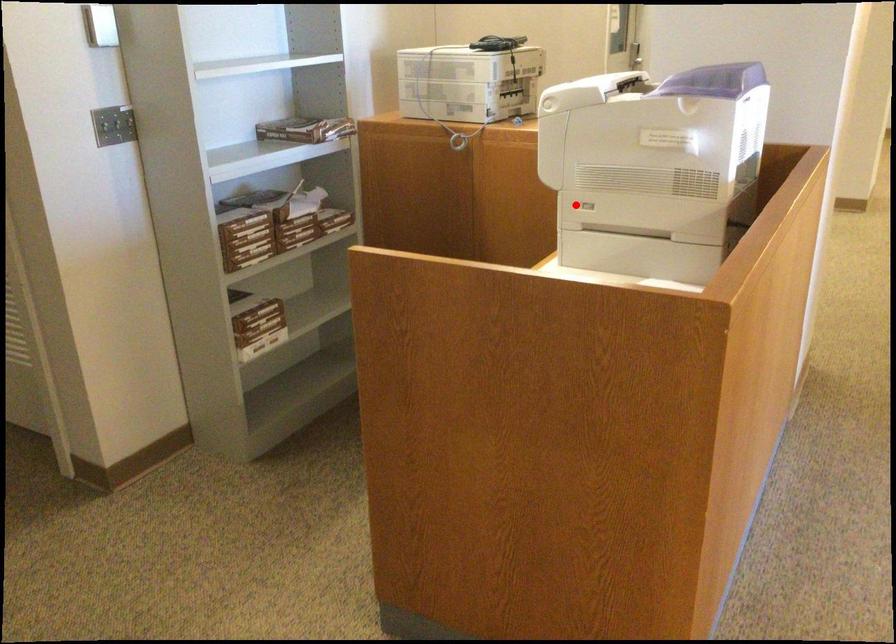
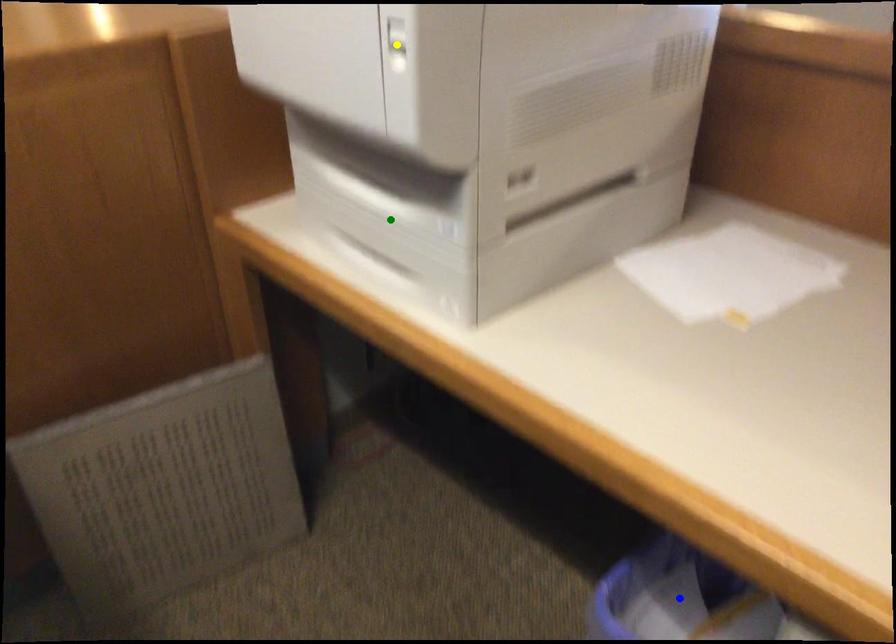
Question: I am providing you with two images of the same scene from different viewpoints. A red point is marked on the first image. You are given multiple points on the second image. Which point in image 2 represents the same 3d spot as the red point in image 1?

Choices:
 (A) blue point
 (B) green point
 (C) yellow point

Answer: (B)